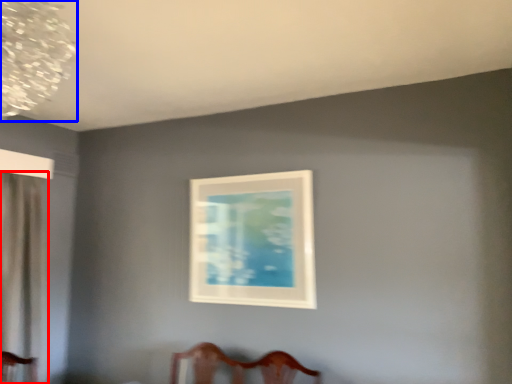
Question: Which point is further to the camera, curtain (highlighted by a red box) or lamp (highlighted by a blue box)?

Choices:
 (A) curtain
 (B) lamp

Answer: (A)